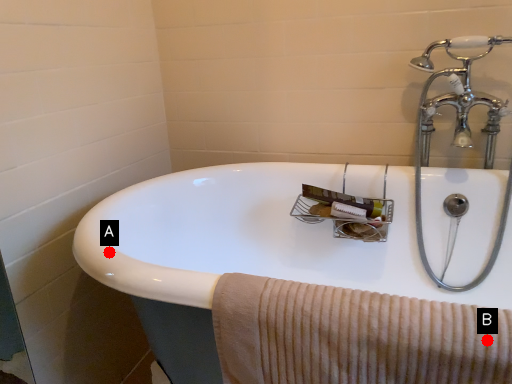
Question: Two points are circled on the image, labeled by A and B beside each circle. Which point is further to the camera?

Choices:
 (A) A is further
 (B) B is further

Answer: (A)